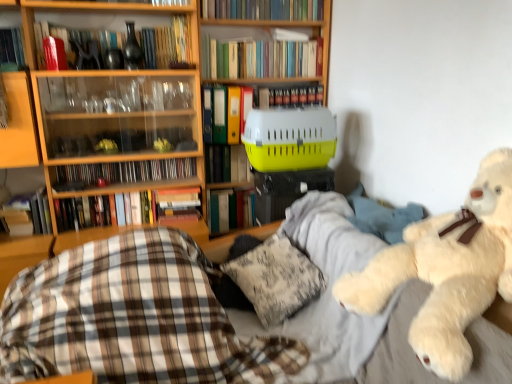
Image resolution: width=512 pixels, height=384 pixels. I want to click on empty space that is ontop of hardcover books at upper center, which ranks as the eighth book in bottom-to-top order, so click(268, 36).